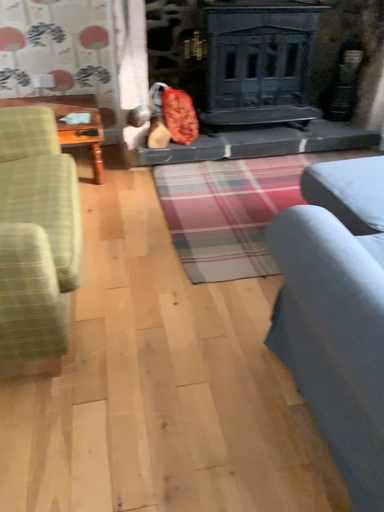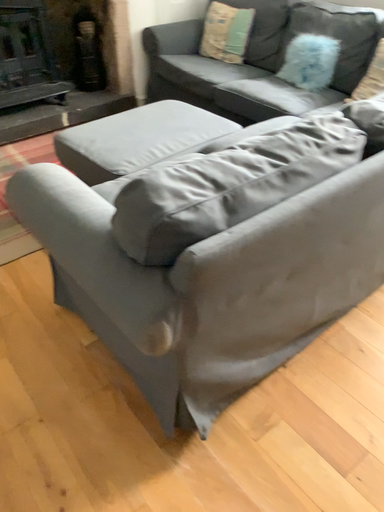
Question: How did the camera likely rotate when shooting the video?

Choices:
 (A) rotated left
 (B) rotated right

Answer: (B)